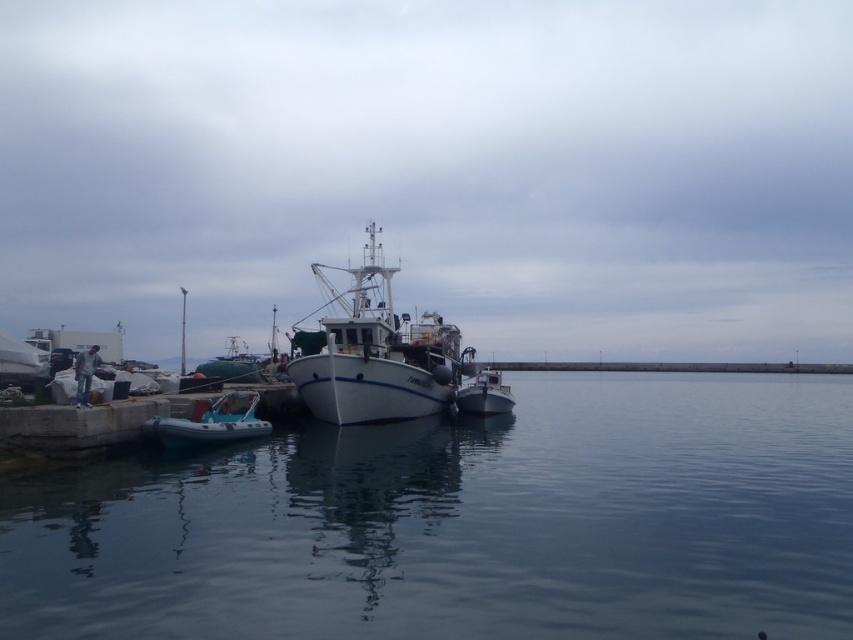
What do you see at coordinates (376, 353) in the screenshot?
I see `white matte boat at center` at bounding box center [376, 353].

Is white matte boat at center shorter than metallic gray dinghy at center?

No.

Where is `white matte boat at center`? white matte boat at center is located at coordinates (376, 353).

Image resolution: width=853 pixels, height=640 pixels. What do you see at coordinates (465, 524) in the screenshot? I see `clear water at center` at bounding box center [465, 524].

Between clear water at center and blue rubber dinghy at lower left, which one appears on the left side from the viewer's perspective?

blue rubber dinghy at lower left

Which is behind, point (457, 481) or point (199, 401)?

The point (199, 401) is more distant.

Locate an element on the screen. The image size is (853, 640). clear water at center is located at coordinates (465, 524).

Which of these two, clear water at center or metallic gray dinghy at center, stands shorter?

metallic gray dinghy at center

Can you confirm if clear water at center is positioned to the left of metallic gray dinghy at center?

In fact, clear water at center is to the right of metallic gray dinghy at center.

Measure the distance between clear water at center and camera.

clear water at center and camera are 19.98 feet apart from each other.

Find the location of `clear water at center`. clear water at center is located at coordinates (465, 524).